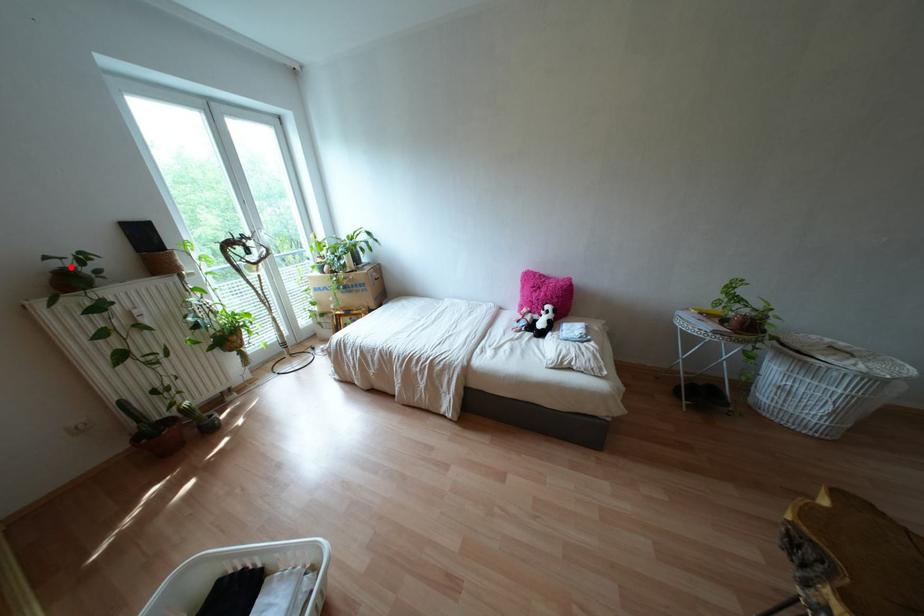
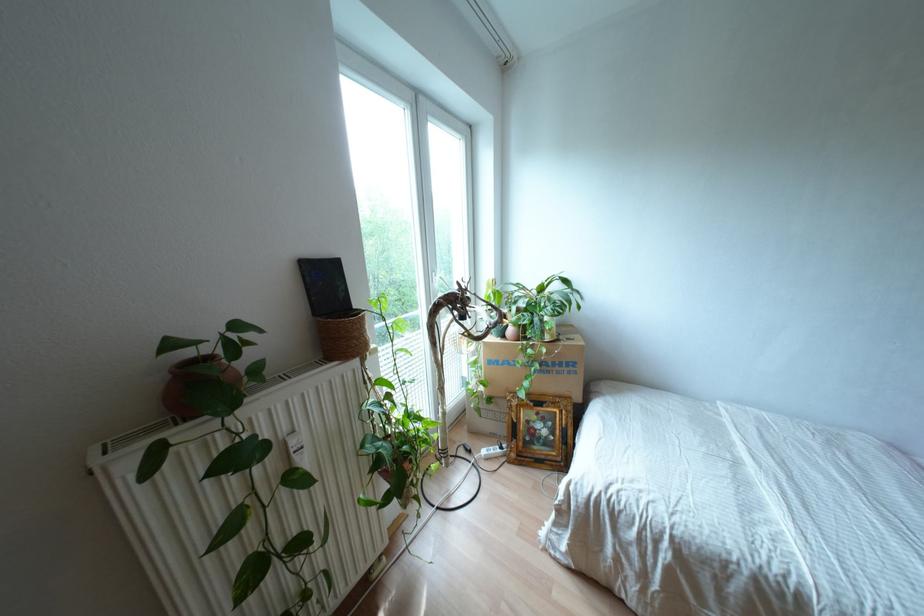
Locate, in the second image, the point that corresponds to the highlighted location in the first image.

(210, 357)